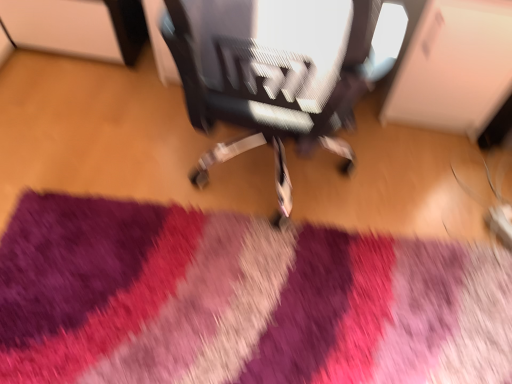
This screenshot has height=384, width=512. I want to click on purple shaggy rug at center, so click(240, 301).

Describe the element at coordinates (240, 301) in the screenshot. I see `purple shaggy rug at center` at that location.

Where is `textured fabric chair at center`? textured fabric chair at center is located at coordinates (276, 79).

The image size is (512, 384). Describe the element at coordinates (276, 79) in the screenshot. I see `textured fabric chair at center` at that location.

What is the approximate width of textured fabric chair at center?

24.03 inches.

Where is `purple shaggy rug at center`? purple shaggy rug at center is located at coordinates (240, 301).

Is textured fabric chair at center at the left side of purple shaggy rug at center?

Incorrect, textured fabric chair at center is not on the left side of purple shaggy rug at center.

Is textured fabric chair at center further to the viewer compared to purple shaggy rug at center?

That is False.

Which is closer to the camera, (170, 37) or (29, 302)?

Point (170, 37) is closer to the camera than point (29, 302).

From the image's perspective, which is above, textured fabric chair at center or purple shaggy rug at center?

textured fabric chair at center, from the image's perspective.

From a real-world perspective, is textured fabric chair at center physically above purple shaggy rug at center?

Yes, from a real-world perspective, textured fabric chair at center is over purple shaggy rug at center

Which object is wider, textured fabric chair at center or purple shaggy rug at center?

With larger width is purple shaggy rug at center.

Consider the image. Is textured fabric chair at center shorter than purple shaggy rug at center?

No.

Which of these two, textured fabric chair at center or purple shaggy rug at center, is smaller?

purple shaggy rug at center is smaller.

Could purple shaggy rug at center be considered to be inside textured fabric chair at center?

No.

Are textured fabric chair at center and purple shaggy rug at center far apart?

No, textured fabric chair at center is not far away from purple shaggy rug at center.

Does textured fabric chair at center turn towards purple shaggy rug at center?

No, textured fabric chair at center is not aimed at purple shaggy rug at center.

What's the angular difference between textured fabric chair at center and purple shaggy rug at center's facing directions?

There is a 173-degree angle between the facing directions of textured fabric chair at center and purple shaggy rug at center.

How distant is textured fabric chair at center from purple shaggy rug at center?

textured fabric chair at center is 18.72 inches from purple shaggy rug at center.

Identify the location of chair located on the right of purple shaggy rug at center. The height and width of the screenshot is (384, 512). (276, 79).

From the picture: Considering the positions of objects purple shaggy rug at center and textured fabric chair at center in the image provided, who is more to the right, purple shaggy rug at center or textured fabric chair at center?

Positioned to the right is textured fabric chair at center.

Considering the relative positions of purple shaggy rug at center and textured fabric chair at center in the image provided, is purple shaggy rug at center in front of textured fabric chair at center?

No, it is not.

Does point (367, 330) lie behind point (190, 108)?

Yes, it is.

From the image's perspective, is purple shaggy rug at center beneath textured fabric chair at center?

Yes, from the image's perspective, purple shaggy rug at center is beneath textured fabric chair at center.

In the scene shown: From a real-world perspective, is purple shaggy rug at center beneath textured fabric chair at center?

Yes.

Considering the sizes of objects purple shaggy rug at center and textured fabric chair at center in the image provided, who is wider, purple shaggy rug at center or textured fabric chair at center?

→ Wider between the two is purple shaggy rug at center.

Between purple shaggy rug at center and textured fabric chair at center, which one has less height?

Standing shorter between the two is purple shaggy rug at center.

Is purple shaggy rug at center bigger than textured fabric chair at center?

No, purple shaggy rug at center is not bigger than textured fabric chair at center.

Is purple shaggy rug at center inside the boundaries of textured fabric chair at center, or outside?

The correct answer is: outside.

Can you see purple shaggy rug at center touching textured fabric chair at center?

Result: No, purple shaggy rug at center is not with textured fabric chair at center.

Is purple shaggy rug at center looking in the opposite direction of textured fabric chair at center?

Yes.

Can you tell me how much purple shaggy rug at center and textured fabric chair at center differ in facing direction?

173 degrees.

Measure the distance between purple shaggy rug at center and textured fabric chair at center.

The distance of purple shaggy rug at center from textured fabric chair at center is 18.72 inches.

The height and width of the screenshot is (384, 512). I want to click on chair in front of the purple shaggy rug at center, so click(276, 79).

At what (x,y) coordinates should I click in order to perform the action: click on mat on the left side of textured fabric chair at center. Please return your answer as a coordinate pair (x, y). The height and width of the screenshot is (384, 512). Looking at the image, I should click on (240, 301).

I want to click on chair above the purple shaggy rug at center (from the image's perspective), so click(x=276, y=79).